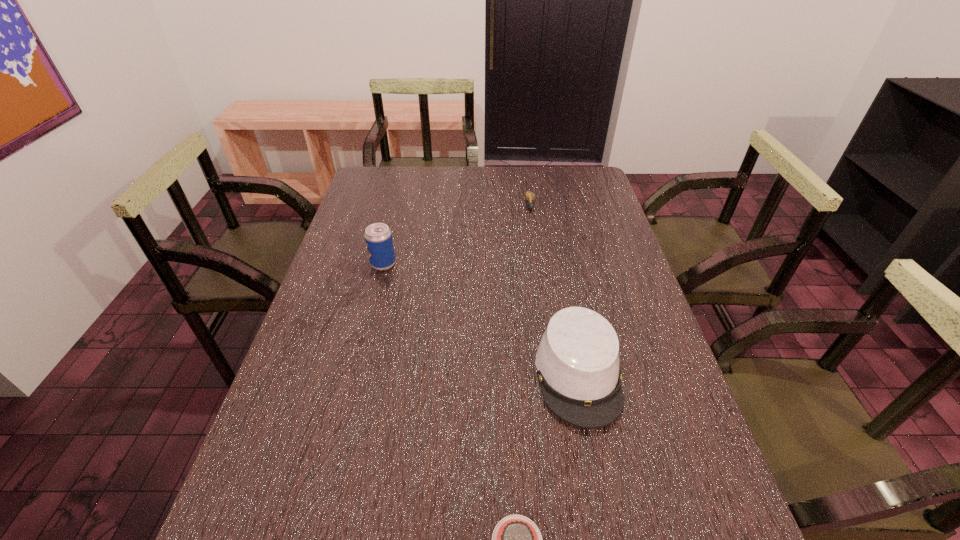
Where is `object positioned at the right edge`? This screenshot has height=540, width=960. object positioned at the right edge is located at coordinates (577, 360).

Identify the location of vacant space at the far edge of the desktop. (537, 178).

Image resolution: width=960 pixels, height=540 pixels. Find the location of `vacant space at the left edge of the desktop`. vacant space at the left edge of the desktop is located at coordinates (349, 259).

In the image, there is a desktop. At what (x,y) coordinates should I click in order to perform the action: click on vacant space at the right edge. Please return your answer as a coordinate pair (x, y). Looking at the image, I should click on (623, 327).

The height and width of the screenshot is (540, 960). Find the location of `vacant space at the far left corner of the desktop`. vacant space at the far left corner of the desktop is located at coordinates (386, 186).

In the image, there is a desktop. Where is `vacant space at the far right corner`? The image size is (960, 540). vacant space at the far right corner is located at coordinates (586, 179).

What are the coordinates of `vacant point located between the escargot and the tallest object` in the screenshot? It's located at tap(457, 235).

The image size is (960, 540). Identify the location of vacant space that is in between the hat and the escargot. [x=554, y=291].

The image size is (960, 540). I want to click on free space between the escargot and the third farthest object, so click(x=554, y=291).

At what (x,y) coordinates should I click in order to perform the action: click on free space that is in between the leftmost object and the third tallest object. Please return your answer as a coordinate pair (x, y). Looking at the image, I should click on (457, 235).